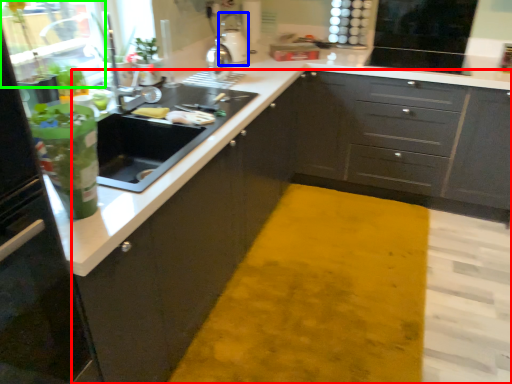
Question: Estimate the real-world distances between objects in this image. Which object is closer to cabinetry (highlighted by a red box), appliance (highlighted by a blue box) or glass door (highlighted by a green box)?

Choices:
 (A) appliance
 (B) glass door

Answer: (A)